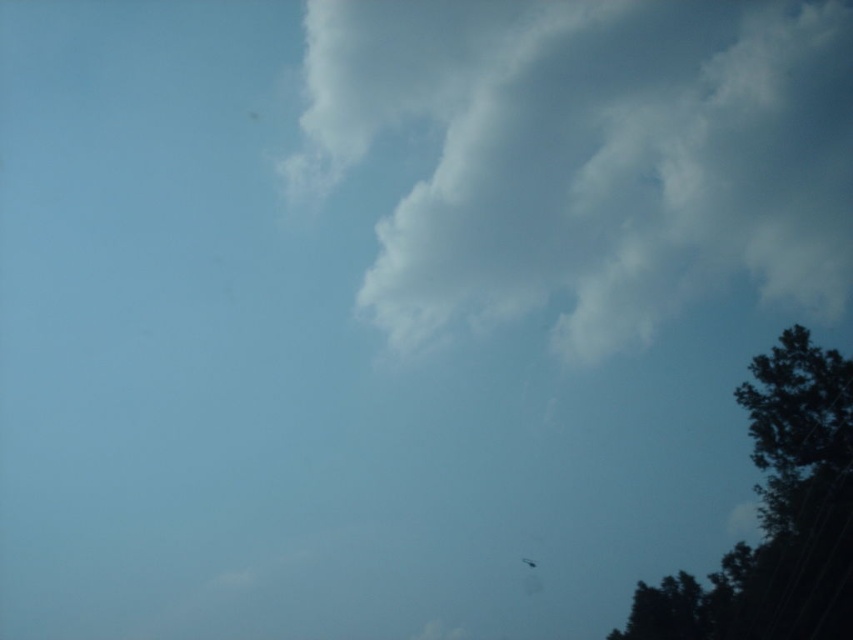
Question: Does white fluffy cloud at upper center have a lesser width compared to translucent white fly at lower right?

Choices:
 (A) no
 (B) yes

Answer: (A)

Question: Is white fluffy cloud at upper center thinner than translucent white fly at lower right?

Choices:
 (A) yes
 (B) no

Answer: (B)

Question: Is white fluffy cloud at upper center to the right of translucent white fly at lower right from the viewer's perspective?

Choices:
 (A) no
 (B) yes

Answer: (B)

Question: Which point is farther from the camera taking this photo?

Choices:
 (A) (755, 140)
 (B) (524, 563)

Answer: (B)